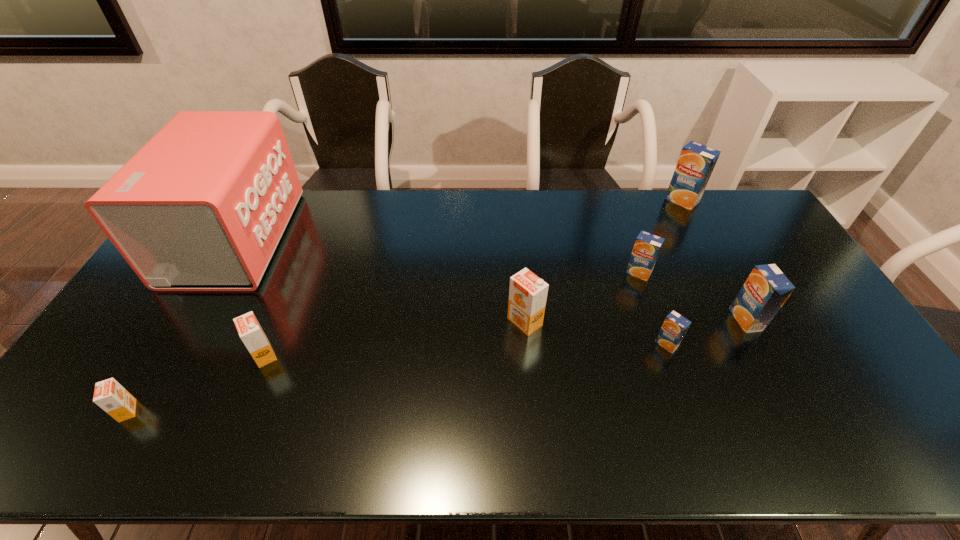
Identify the location of vacant space that satisfies the following two spatial constraints: 1. on the surface of the pink box where the text is embossed; 2. on the right side of the rightmost orange orange juice. (187, 322).

Find the location of a particular element. The width and height of the screenshot is (960, 540). blank area in the image that satisfies the following two spatial constraints: 1. on the back side of the smallest blue orange_juice; 2. on the left side of the second orange orange juice from right to left is located at coordinates (269, 344).